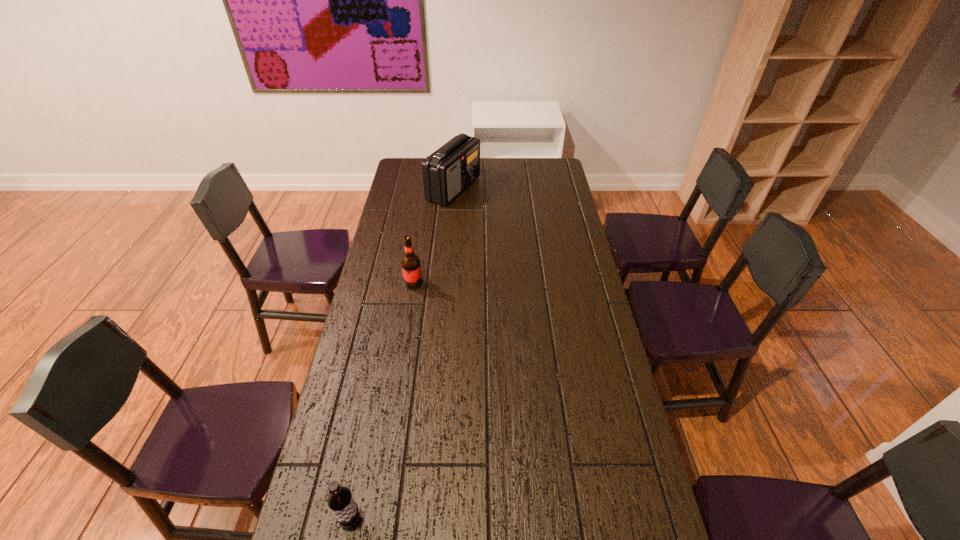
The image size is (960, 540). In the image, there is a desktop. In order to click on vacant space at the left edge in this screenshot , I will do `click(374, 372)`.

I want to click on vacant region at the right edge, so click(561, 185).

Image resolution: width=960 pixels, height=540 pixels. I want to click on vacant space at the far right corner, so click(560, 159).

Find the location of a particular element. blank region between the radio receiver and the leftmost object is located at coordinates (402, 354).

You are a GUI agent. You are given a task and a screenshot of the screen. Output one action in this format:
    pyautogui.click(x=<x>, y=<y>)
    Task: Click on the free spot between the radio receiver and the nearest object
    This screenshot has width=960, height=540.
    Given the screenshot: What is the action you would take?
    click(x=402, y=354)

What are the coordinates of `blank region between the radio receiver and the right root beer` in the screenshot? It's located at (434, 236).

You are a GUI agent. You are given a task and a screenshot of the screen. Output one action in this format:
    pyautogui.click(x=<x>, y=<y>)
    Task: Click on the vacant area that lies between the farthest object and the shortest object
    The height and width of the screenshot is (540, 960).
    Given the screenshot: What is the action you would take?
    pyautogui.click(x=402, y=354)

I want to click on free spot between the second nearest object and the farthest object, so click(x=434, y=236).

Find the location of `vacant space that is in between the nearest object and the second nearest object`. vacant space that is in between the nearest object and the second nearest object is located at coordinates (382, 401).

Identify the location of free space between the farther root beer and the farthest object. This screenshot has height=540, width=960. (434, 236).